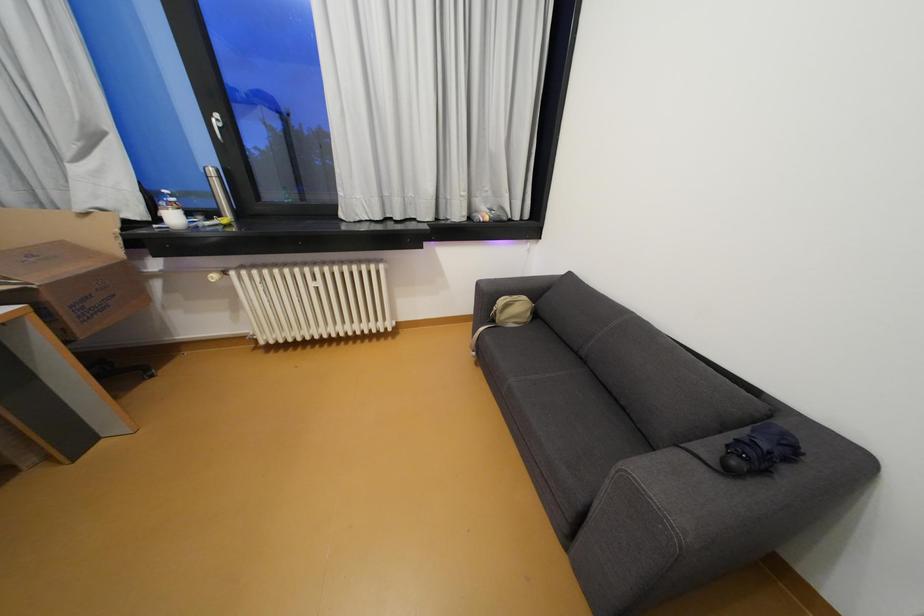
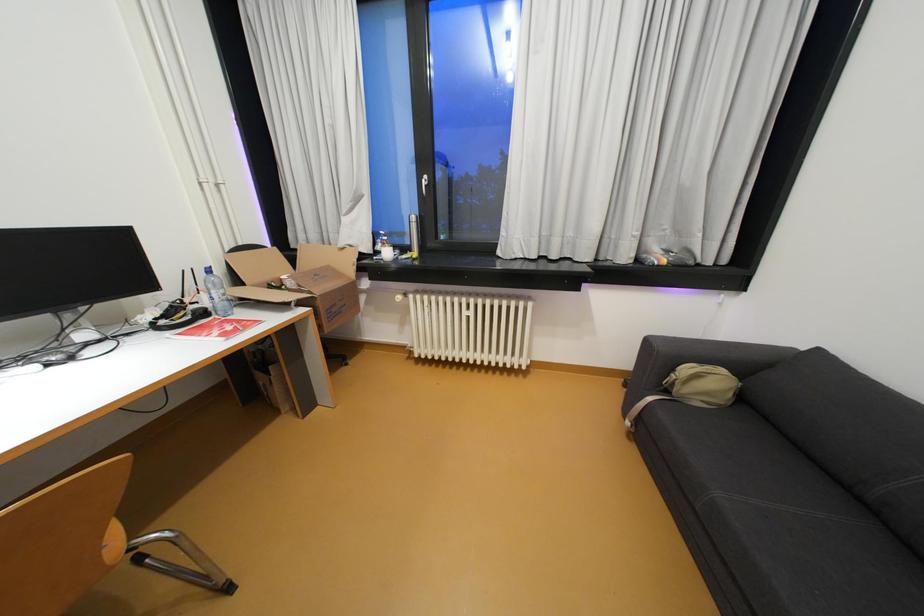
Question: The camera is either moving clockwise (left) or counter-clockwise (right) around the object. The first image is from the beginning of the video and the second image is from the end. Is the camera moving left or right when shooting the video?

Choices:
 (A) Left
 (B) Right

Answer: (B)